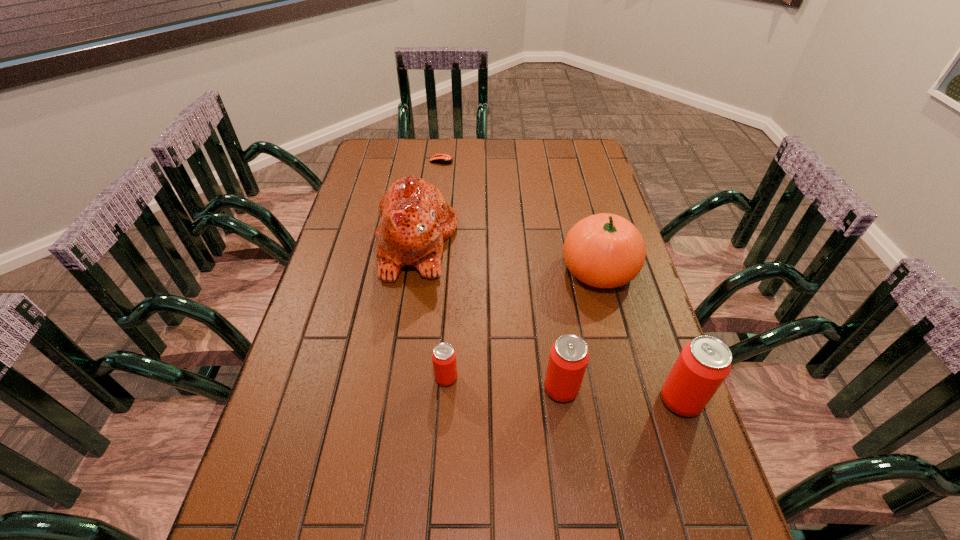
Locate an element on the screen. blank area in the image that satisfies the following two spatial constraints: 1. on the face of the pumpkin; 2. on the right side of the cat is located at coordinates (412, 270).